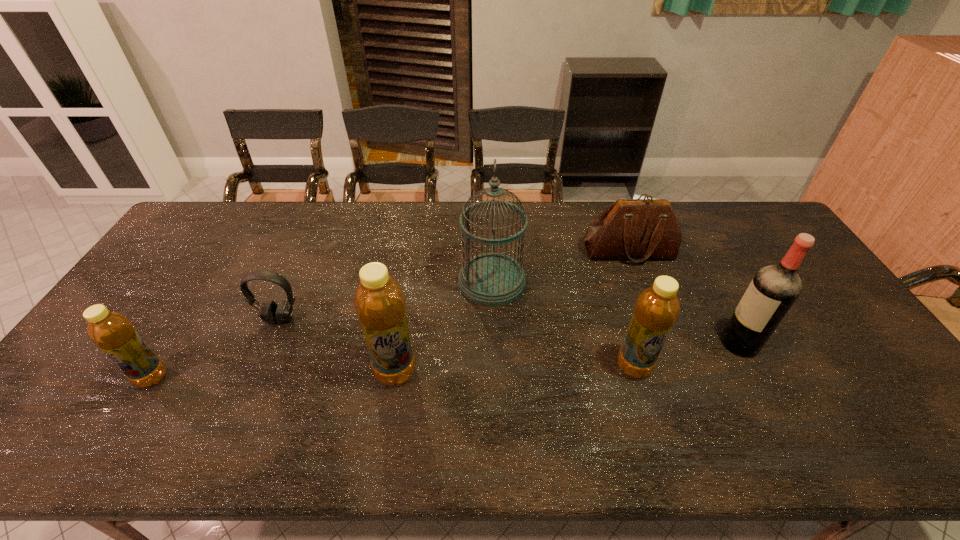
The image size is (960, 540). Find the location of `vacant region located 0.140m on the left of the leftmost bottle`. vacant region located 0.140m on the left of the leftmost bottle is located at coordinates (81, 377).

Where is `vacant area situated on the left of the second bottle from left to right`? This screenshot has width=960, height=540. vacant area situated on the left of the second bottle from left to right is located at coordinates (217, 372).

Where is `vacant space situated 0.200m on the left of the second tallest bottle`? This screenshot has width=960, height=540. vacant space situated 0.200m on the left of the second tallest bottle is located at coordinates (538, 366).

Locate an element on the screen. vacant area situated 0.330m on the right of the shoulder bag is located at coordinates (777, 252).

This screenshot has height=540, width=960. Identify the location of vacant space located on the front-facing side of the liquor. (576, 343).

The width and height of the screenshot is (960, 540). I want to click on blank space located 0.360m on the front-facing side of the liquor, so click(x=588, y=343).

This screenshot has height=540, width=960. Find the location of `vacant space located on the front-facing side of the liquor`. vacant space located on the front-facing side of the liquor is located at coordinates (651, 343).

Where is `free space located 0.310m on the front-facing side of the fourth object from right to left`? The width and height of the screenshot is (960, 540). free space located 0.310m on the front-facing side of the fourth object from right to left is located at coordinates (357, 282).

You are a GUI agent. You are given a task and a screenshot of the screen. Output one action in this format:
    pyautogui.click(x=<x>, y=<y>)
    Task: Click on the free spot located 0.350m on the front-facing side of the fourth object from right to left
    This screenshot has height=540, width=960.
    Given the screenshot: What is the action you would take?
    pyautogui.click(x=344, y=282)

Locate an element on the screen. This screenshot has width=960, height=540. vacant area situated 0.210m on the front-facing side of the fourth object from right to left is located at coordinates (390, 282).